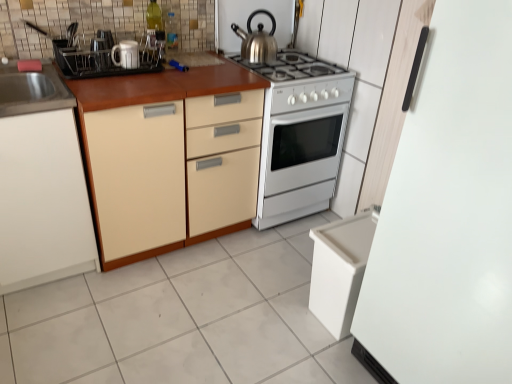
Locate an element on the screen. This screenshot has height=384, width=512. free space in front of white plastic dishwasher at lower right is located at coordinates (324, 363).